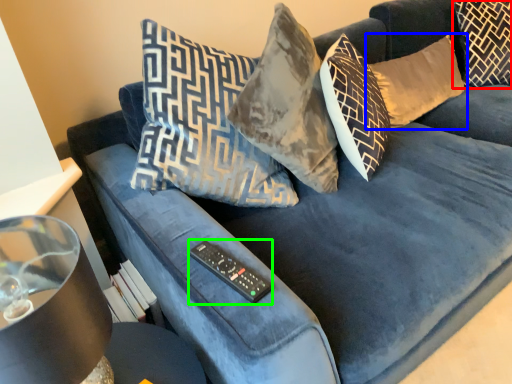
Question: Considering the real-world distances, which object is farthest from pillow (highlighted by a red box)? pillow (highlighted by a blue box) or remote (highlighted by a green box)?

Choices:
 (A) pillow
 (B) remote

Answer: (B)